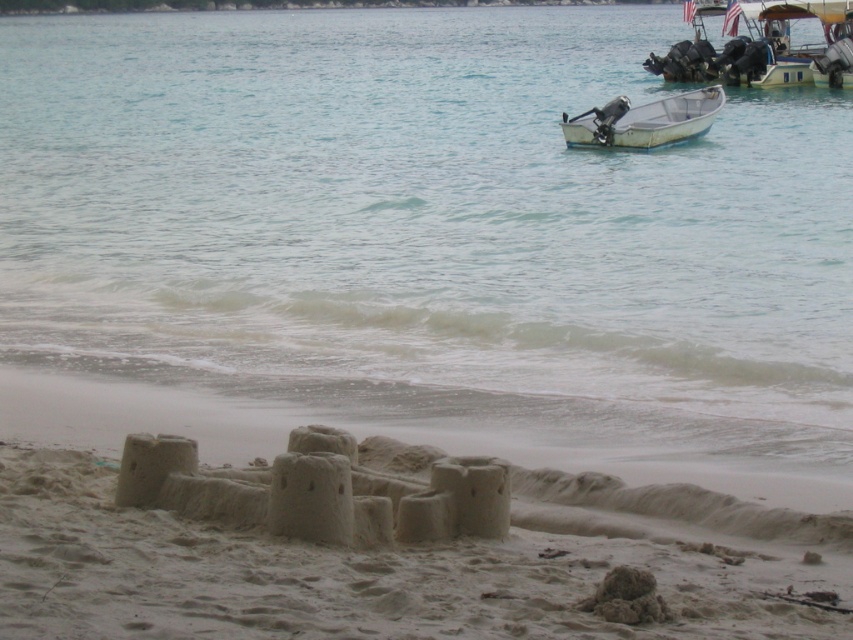
You are standing at the sandcastle and want to reach the clear water at sand lower. Which direction should you walk to get there?

You should walk towards the lower part of the sand to reach the clear water at sand lower, as it is located at point (x=427, y=227).

From the picture: You are a photographer standing at the edge of the beach. You want to capture a photo that includes both the beige sandy castle at lower center and the metallic silver boat at upper right. Which object should you position closer to the bottom of your camera frame to ensure both are visible?

You should position the beige sandy castle at lower center closer to the bottom of your camera frame because it is shorter than the metallic silver boat at upper right, allowing both to fit within the frame.